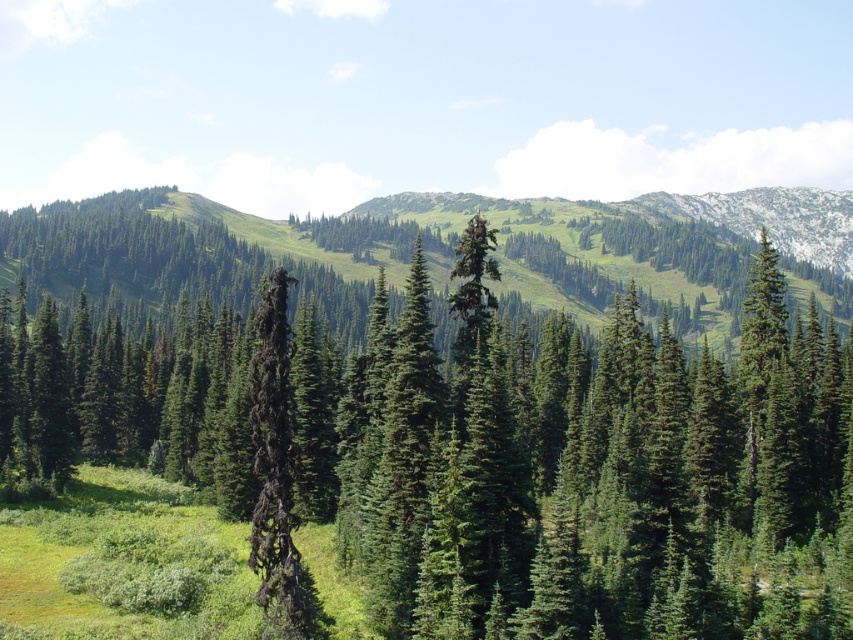
Can you confirm if green matte tree at center is shorter than dark brown/charred wood tree at center?

Incorrect, green matte tree at center's height does not fall short of dark brown/charred wood tree at center's.

Describe the element at coordinates (482, 452) in the screenshot. I see `green matte tree at center` at that location.

Between point (91, 387) and point (292, 563), which one is positioned in front?

Point (292, 563) is in front.

The width and height of the screenshot is (853, 640). In order to click on green matte tree at center in this screenshot , I will do point(482,452).